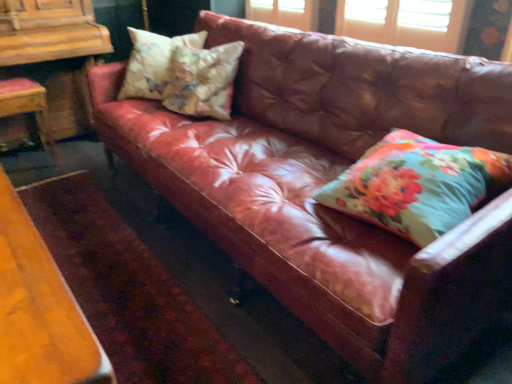
Question: Should I look upward or downward to see floral fabric pillow at right, placed as the 3th pillow when sorted from left to right?

Choices:
 (A) down
 (B) up

Answer: (B)

Question: From the image's perspective, does floral fabric cushion at upper left, placed as the second pillow when sorted from back to front, appear lower than wooden chair at left?

Choices:
 (A) yes
 (B) no

Answer: (B)

Question: Is floral fabric cushion at upper left, which is the second pillow from front to back, surrounding wooden chair at left?

Choices:
 (A) yes
 (B) no

Answer: (B)

Question: Is floral fabric cushion at upper left, the 2th pillow positioned from the right, located outside wooden chair at left?

Choices:
 (A) yes
 (B) no

Answer: (A)

Question: From the image's perspective, is floral fabric cushion at upper left, the 2th pillow positioned from the right, on wooden chair at left?

Choices:
 (A) no
 (B) yes

Answer: (B)

Question: Does floral fabric cushion at upper left, which is the second pillow from front to back, have a smaller size compared to wooden chair at left?

Choices:
 (A) yes
 (B) no

Answer: (A)

Question: From a real-world perspective, is floral fabric cushion at upper left, the 2th pillow positioned from the right, positioned over wooden chair at left based on gravity?

Choices:
 (A) yes
 (B) no

Answer: (A)

Question: Can you confirm if floral fabric pillow at right, placed as the third pillow when sorted from back to front, is positioned to the left of floral fabric pillow at upper left, positioned as the 3th pillow in right-to-left order?

Choices:
 (A) no
 (B) yes

Answer: (A)

Question: From the image's perspective, is floral fabric pillow at right, placed as the third pillow when sorted from back to front, located above floral fabric pillow at upper left, positioned as the third pillow in front-to-back order?

Choices:
 (A) no
 (B) yes

Answer: (A)

Question: Is floral fabric pillow at right, which is the first pillow from front to back, positioned in front of floral fabric pillow at upper left, positioned as the third pillow in front-to-back order?

Choices:
 (A) yes
 (B) no

Answer: (A)

Question: Does floral fabric pillow at right, placed as the third pillow when sorted from back to front, touch floral fabric pillow at upper left, positioned as the third pillow in front-to-back order?

Choices:
 (A) no
 (B) yes

Answer: (A)

Question: Is floral fabric pillow at right, which is the first pillow from front to back, further to the viewer compared to floral fabric pillow at upper left, the first pillow when ordered from back to front?

Choices:
 (A) yes
 (B) no

Answer: (B)

Question: Is floral fabric pillow at right, placed as the 3th pillow when sorted from left to right, looking in the opposite direction of floral fabric pillow at upper left, the first pillow when ordered from back to front?

Choices:
 (A) yes
 (B) no

Answer: (B)

Question: Is wooden chair at left aimed at floral fabric pillow at right, which ranks as the first pillow in right-to-left order?

Choices:
 (A) yes
 (B) no

Answer: (B)